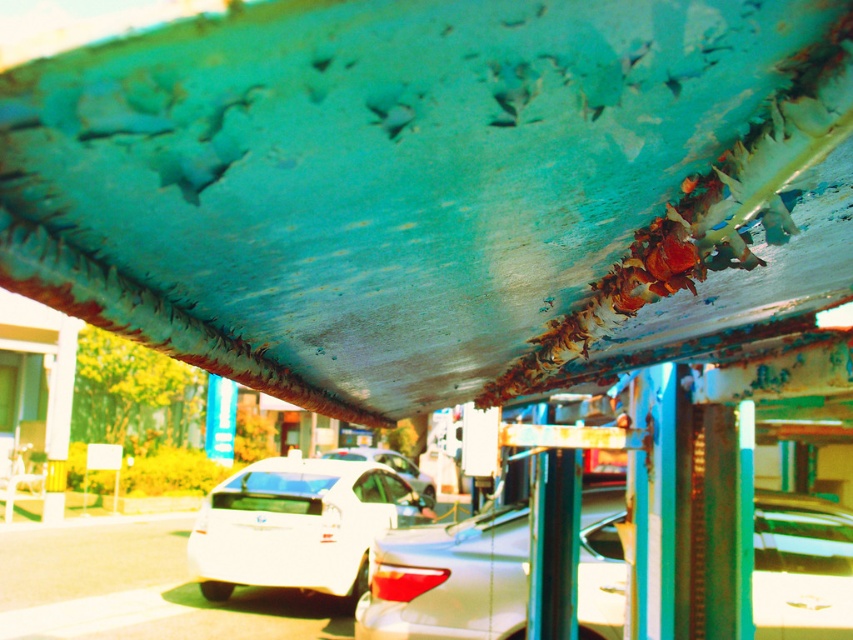
Between satin white sedan at center and shiny white car at center, which one appears on the right side from the viewer's perspective?

satin white sedan at center

Which is in front, point (838, 627) or point (340, 449)?

Point (838, 627) is in front.

Where is `satin white sedan at center`? The height and width of the screenshot is (640, 853). satin white sedan at center is located at coordinates (450, 580).

Consider the image. Who is lower down, satin white sedan at center or white matte car at center?

white matte car at center

Does satin white sedan at center come behind white matte car at center?

No, it is not.

The width and height of the screenshot is (853, 640). What are the coordinates of `satin white sedan at center` in the screenshot? It's located at (450, 580).

Between point (247, 515) and point (407, 472), which one is positioned in front?

Point (247, 515) is in front.

Can you confirm if white matte car at center is taller than shiny white car at center?

No, white matte car at center is not taller than shiny white car at center.

Who is more distant from viewer, (355, 484) or (399, 458)?

Point (399, 458)

Locate an element on the screen. This screenshot has height=640, width=853. white matte car at center is located at coordinates (299, 524).